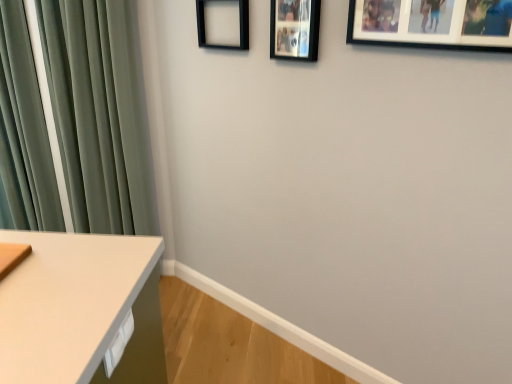
Question: Considering the positions of black matte picture frame at upper center, which appears as the first picture frame when viewed from the left, and black matte picture frame at upper center, which is the second picture frame in left-to-right order, in the image, is black matte picture frame at upper center, which appears as the first picture frame when viewed from the left, bigger or smaller than black matte picture frame at upper center, which is the second picture frame in left-to-right order,?

Choices:
 (A) big
 (B) small

Answer: (A)

Question: From the image's perspective, is black matte picture frame at upper center, positioned as the 3th picture frame in front-to-back order, located above or below black matte picture frame at upper center, marked as the second picture frame in a right-to-left arrangement?

Choices:
 (A) above
 (B) below

Answer: (A)

Question: Based on their relative distances, which object is nearer to the black matte picture frame at upper center, the 1th picture frame positioned from the back?

Choices:
 (A) green velvet curtain at left
 (B) black matte picture frame at upper center, which is the second picture frame in left-to-right order
 (C) black matte picture frame at upper right, which is the third picture frame from back to front
 (D) white glossy drawer at lower left

Answer: (B)

Question: Which object is the farthest from the black matte picture frame at upper right, which is the first picture frame from right to left?

Choices:
 (A) green velvet curtain at left
 (B) white glossy drawer at lower left
 (C) black matte picture frame at upper center, placed as the 2th picture frame when sorted from back to front
 (D) black matte picture frame at upper center, which is the 3th picture frame in right-to-left order

Answer: (A)